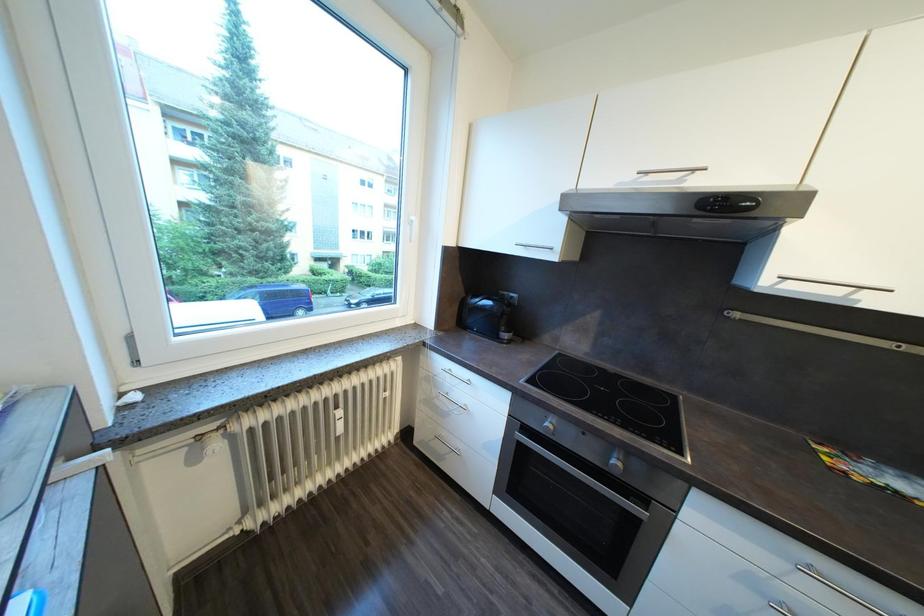
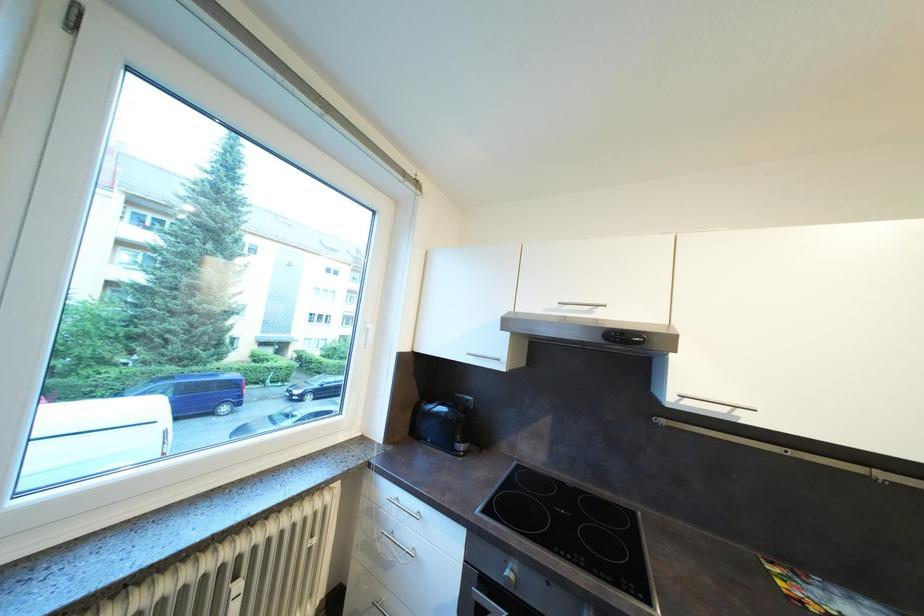
In a continuous first-person perspective shot, in which direction is the camera moving?

The movement direction of the cameraman is right, backward.